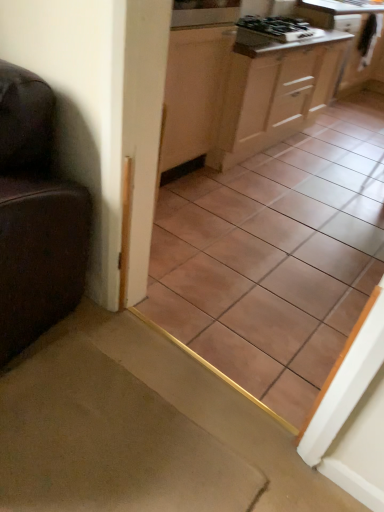
What do you see at coordinates (275, 256) in the screenshot? The image size is (384, 512). I see `brown ceramic tile at center` at bounding box center [275, 256].

What do you see at coordinates (140, 430) in the screenshot?
I see `carpet at lower left` at bounding box center [140, 430].

Image resolution: width=384 pixels, height=512 pixels. What do you see at coordinates (341, 7) in the screenshot?
I see `white glossy countertop at upper right` at bounding box center [341, 7].

This screenshot has width=384, height=512. Identify the location of black glossy gas stove at upper center. (276, 29).

Between black glossy gas stove at upper center and carpet at lower left, which one has larger size?

carpet at lower left is bigger.

Is black glossy gas stove at upper center outside of carpet at lower left?

Yes, black glossy gas stove at upper center is located beyond the bounds of carpet at lower left.

Is black glossy gas stove at upper center not close to carpet at lower left?

→ black glossy gas stove at upper center is positioned a significant distance from carpet at lower left.

Is there a large distance between brown ceramic tile at center and white glossy countertop at upper right?

Yes, brown ceramic tile at center and white glossy countertop at upper right are located far from each other.

Considering the positions of objects brown ceramic tile at center and white glossy countertop at upper right in the image provided, who is more to the left, brown ceramic tile at center or white glossy countertop at upper right?

brown ceramic tile at center.

Which object is closer to the camera taking this photo, brown ceramic tile at center or white glossy countertop at upper right?

brown ceramic tile at center.

From their relative heights in the image, would you say brown ceramic tile at center is taller or shorter than white glossy countertop at upper right?

brown ceramic tile at center is taller than white glossy countertop at upper right.

Who is taller, light wood cabinet at center, positioned as the 2th cabinetry in right-to-left order, or white glossy countertop at upper right?

light wood cabinet at center, positioned as the 2th cabinetry in right-to-left order.

Is light wood cabinet at center, marked as the second cabinetry in a back-to-front arrangement, in contact with white glossy countertop at upper right?

No, light wood cabinet at center, marked as the second cabinetry in a back-to-front arrangement, is not with white glossy countertop at upper right.

From the image's perspective, does light wood cabinet at center, marked as the second cabinetry in a back-to-front arrangement, appear lower than white glossy countertop at upper right?

Correct, light wood cabinet at center, marked as the second cabinetry in a back-to-front arrangement, appears lower than white glossy countertop at upper right in the image.

Do you think light wood cabinet at center, positioned as the 2th cabinetry in right-to-left order, is within white glossy countertop at upper right, or outside of it?

light wood cabinet at center, positioned as the 2th cabinetry in right-to-left order, is located beyond the bounds of white glossy countertop at upper right.

Which is farther, (308, 1) or (365, 110)?

The point (365, 110) is more distant.

Can brown ceramic tile at center be found inside white glossy countertop at upper right?

No, white glossy countertop at upper right does not contain brown ceramic tile at center.

From a real-world perspective, is white glossy countertop at upper right positioned over brown ceramic tile at center based on gravity?

Indeed, from a real-world perspective, white glossy countertop at upper right stands above brown ceramic tile at center.

What are the coordinates of `ceramic tile in front of the white glossy countertop at upper right` in the screenshot? It's located at (275, 256).

Relative to light wood cabinet at center, marked as the second cabinetry in a back-to-front arrangement, is white glossy countertop at upper right in front or behind?

Visually, white glossy countertop at upper right is located behind light wood cabinet at center, marked as the second cabinetry in a back-to-front arrangement.

Considering the sizes of objects white glossy countertop at upper right and light wood cabinet at center, marked as the second cabinetry in a back-to-front arrangement, in the image provided, who is wider, white glossy countertop at upper right or light wood cabinet at center, marked as the second cabinetry in a back-to-front arrangement,?

With larger width is white glossy countertop at upper right.

Identify the location of counter top lying on the right of light wood cabinet at center, the first cabinetry in the front-to-back sequence. (341, 7).

Would you consider white glossy countertop at upper right to be distant from light wood cabinet at center, the first cabinetry in the front-to-back sequence?

They are positioned close to each other.

Considering the positions of point (352, 230) and point (353, 31), is point (352, 230) closer or farther from the camera than point (353, 31)?

Point (352, 230) appears to be closer to the viewer than point (353, 31).

Is wooden cabinet at upper right, which is the 1th cabinetry in right-to-left order, located within brown ceramic tile at center?

No.

Is brown ceramic tile at center in front of or behind wooden cabinet at upper right, which is the 1th cabinetry in right-to-left order, in the image?

Visually, brown ceramic tile at center is located in front of wooden cabinet at upper right, which is the 1th cabinetry in right-to-left order.

From a real-world perspective, is white glossy countertop at upper right on top of wooden cabinet at upper right, arranged as the 2th cabinetry when viewed from the front?

Yes, from a real-world perspective, white glossy countertop at upper right is on top of wooden cabinet at upper right, arranged as the 2th cabinetry when viewed from the front.

Consider the image. Is white glossy countertop at upper right outside of wooden cabinet at upper right, the first cabinetry viewed from the back?

No, white glossy countertop at upper right is inside wooden cabinet at upper right, the first cabinetry viewed from the back,'s boundary.

Does white glossy countertop at upper right have a lesser height compared to wooden cabinet at upper right, arranged as the 2th cabinetry when viewed from the front?

Yes.

From the image's perspective, is white glossy countertop at upper right located above or below wooden cabinet at upper right, the first cabinetry viewed from the back?

white glossy countertop at upper right is above wooden cabinet at upper right, the first cabinetry viewed from the back.

Image resolution: width=384 pixels, height=512 pixels. In the image, there is a carpet at lower left. Find the location of `gas stove above it (from the image's perspective)`. gas stove above it (from the image's perspective) is located at coordinates click(x=276, y=29).

You are a GUI agent. You are given a task and a screenshot of the screen. Output one action in this format:
    pyautogui.click(x=<x>, y=<y>)
    Task: Click on the ceramic tile below the white glossy countertop at upper right (from a real-world perspective)
    The height and width of the screenshot is (512, 384).
    Given the screenshot: What is the action you would take?
    pyautogui.click(x=275, y=256)

Which object lies nearer to the anchor point carpet at lower left, brown ceramic tile at center or black glossy gas stove at upper center?

The object closer to carpet at lower left is brown ceramic tile at center.

Estimate the real-world distances between objects in this image. Which object is further from brown ceramic tile at center, wooden cabinet at upper right, arranged as the 2th cabinetry when viewed from the front, or carpet at lower left?

wooden cabinet at upper right, arranged as the 2th cabinetry when viewed from the front, is positioned further to the anchor brown ceramic tile at center.

Considering their positions, is brown ceramic tile at center positioned further to black glossy gas stove at upper center than white glossy countertop at upper right?

brown ceramic tile at center.

Looking at the image, which one is located further to white glossy countertop at upper right, carpet at lower left or wooden cabinet at upper right, the first cabinetry viewed from the back?

carpet at lower left is positioned further to the anchor white glossy countertop at upper right.

From the image, which object appears to be farther from carpet at lower left, brown ceramic tile at center or wooden cabinet at upper right, which is the 1th cabinetry in right-to-left order?

wooden cabinet at upper right, which is the 1th cabinetry in right-to-left order, is further to carpet at lower left.

When comparing their distances from carpet at lower left, does brown ceramic tile at center or light wood cabinet at center, positioned as the 2th cabinetry in right-to-left order, seem closer?

brown ceramic tile at center lies closer to carpet at lower left than the other object.

Looking at the image, which one is located further to brown ceramic tile at center, carpet at lower left or light wood cabinet at center, positioned as the 2th cabinetry in right-to-left order?

carpet at lower left.

Which object lies nearer to the anchor point black glossy gas stove at upper center, light wood cabinet at center, placed as the 1th cabinetry when sorted from left to right, or brown ceramic tile at center?

Among the two, light wood cabinet at center, placed as the 1th cabinetry when sorted from left to right, is located nearer to black glossy gas stove at upper center.

What are the coordinates of `cabinetry between brown ceramic tile at center and black glossy gas stove at upper center from front to back` in the screenshot? It's located at (273, 92).

Locate an element on the screen. gas stove between light wood cabinet at center, placed as the 1th cabinetry when sorted from left to right, and wooden cabinet at upper right, the first cabinetry viewed from the back, from front to back is located at coordinates (276, 29).

Identify the location of stairwell between brown ceramic tile at center and white glossy countertop at upper right from front to back. This screenshot has width=384, height=512. (140, 430).

At what (x,y) coordinates should I click in order to perform the action: click on cabinetry located between brown ceramic tile at center and wooden cabinet at upper right, the first cabinetry viewed from the back, in the depth direction. Please return your answer as a coordinate pair (x, y). This screenshot has height=512, width=384. Looking at the image, I should click on (273, 92).